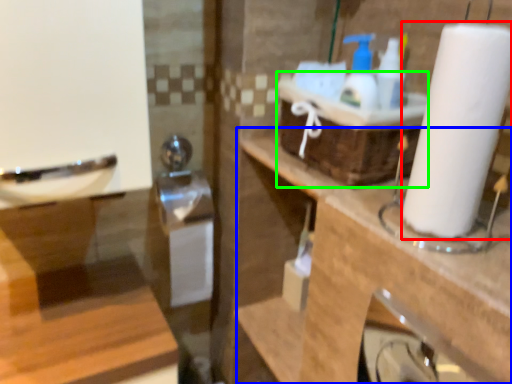
Question: Which object is positioned closest to paper towel (highlighted by a red box)? Select from counter top (highlighted by a blue box) and basket (highlighted by a green box).

Choices:
 (A) counter top
 (B) basket

Answer: (B)